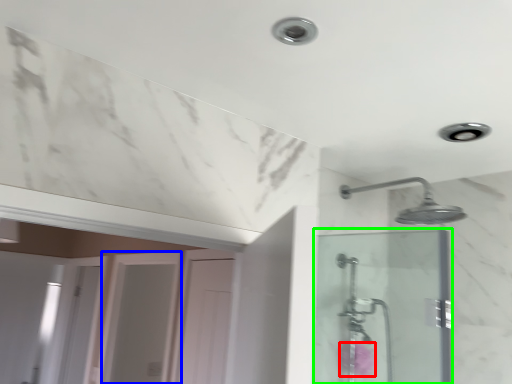
Question: Which object is positioned farthest from flower (highlighted by a red box)? Select from screen door (highlighted by a blue box) and screen door (highlighted by a green box).

Choices:
 (A) screen door
 (B) screen door

Answer: (A)